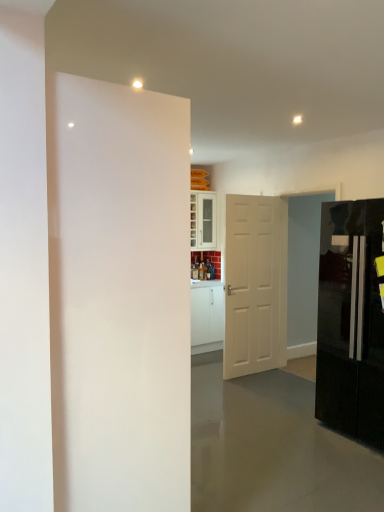
Describe the element at coordinates (255, 284) in the screenshot. This screenshot has width=384, height=512. I see `white matte door at center, acting as the first door starting from the right` at that location.

This screenshot has height=512, width=384. What do you see at coordinates (118, 295) in the screenshot? I see `white glossy door at left, marked as the 2th door in a right-to-left arrangement` at bounding box center [118, 295].

Describe the element at coordinates (203, 220) in the screenshot. I see `white glossy cabinet at center` at that location.

Describe the element at coordinates (351, 321) in the screenshot. The width and height of the screenshot is (384, 512). I see `glossy black refrigerator at right` at that location.

What are the coordinates of `white matte door at center, acting as the first door starting from the right` in the screenshot? It's located at (255, 284).

Is white glossy cabinet at center wider than white glossy door at left, the 1th door in the front-to-back sequence?

No.

Considering the relative sizes of white glossy cabinet at center and white glossy door at left, marked as the first door in a left-to-right arrangement, in the image provided, is white glossy cabinet at center shorter than white glossy door at left, marked as the first door in a left-to-right arrangement,?

Yes.

Is point (192, 206) less distant than point (114, 429)?

That is False.

In the image, is white glossy cabinet at center positioned in front of or behind white glossy door at left, marked as the first door in a left-to-right arrangement?

white glossy cabinet at center is positioned farther from the viewer than white glossy door at left, marked as the first door in a left-to-right arrangement.

Is white glossy door at left, marked as the 2th door in a right-to-left arrangement, inside or outside of glossy black refrigerator at right?

white glossy door at left, marked as the 2th door in a right-to-left arrangement, lies outside glossy black refrigerator at right.

From the image's perspective, is white glossy door at left, marked as the 2th door in a right-to-left arrangement, on top of glossy black refrigerator at right?

Yes, from the image's perspective, white glossy door at left, marked as the 2th door in a right-to-left arrangement, is on top of glossy black refrigerator at right.

Is white glossy door at left, acting as the 2th door starting from the back, facing towards glossy black refrigerator at right?

Yes, white glossy door at left, acting as the 2th door starting from the back, is oriented towards glossy black refrigerator at right.

Considering the relative positions of white glossy door at left, acting as the 2th door starting from the back, and glossy black refrigerator at right in the image provided, is white glossy door at left, acting as the 2th door starting from the back, in front of glossy black refrigerator at right?

Yes, it is.

Considering the sizes of white glossy cabinet at center and glossy black refrigerator at right in the image, is white glossy cabinet at center bigger or smaller than glossy black refrigerator at right?

Clearly, white glossy cabinet at center is smaller in size than glossy black refrigerator at right.

Considering the relative sizes of white glossy cabinet at center and glossy black refrigerator at right in the image provided, is white glossy cabinet at center wider than glossy black refrigerator at right?

No, white glossy cabinet at center is not wider than glossy black refrigerator at right.

The height and width of the screenshot is (512, 384). Identify the location of refrigerator below the white glossy cabinet at center (from a real-world perspective). (351, 321).

Are white glossy cabinet at center and glossy black refrigerator at right making contact?

They are not placed beside each other.

From the image's perspective, between white matte door at center, acting as the first door starting from the right, and white glossy door at left, acting as the 2th door starting from the back, who is located below?

From the image's view, white glossy door at left, acting as the 2th door starting from the back, is below.

Consider the image. Considering the sizes of objects white matte door at center, which is counted as the 2th door, starting from the left, and white glossy door at left, marked as the 2th door in a right-to-left arrangement, in the image provided, who is thinner, white matte door at center, which is counted as the 2th door, starting from the left, or white glossy door at left, marked as the 2th door in a right-to-left arrangement,?

Thinner between the two is white matte door at center, which is counted as the 2th door, starting from the left.

Locate an element on the screen. Image resolution: width=384 pixels, height=512 pixels. door above the white matte door at center, acting as the first door starting from the right (from a real-world perspective) is located at coordinates (118, 295).

Is white matte door at center, which is counted as the 2th door, starting from the left, looking in the opposite direction of white glossy door at left, acting as the 2th door starting from the back?

No, white matte door at center, which is counted as the 2th door, starting from the left, is not facing the opposite direction of white glossy door at left, acting as the 2th door starting from the back.

Consider the image. Who is taller, white matte door at center, which ranks as the 1th door in back-to-front order, or glossy black refrigerator at right?

white matte door at center, which ranks as the 1th door in back-to-front order.

Does white matte door at center, which is counted as the 2th door, starting from the left, touch glossy black refrigerator at right?

They are not placed beside each other.

Is white matte door at center, the second door viewed from the front, completely or partially outside of glossy black refrigerator at right?

Yes, white matte door at center, the second door viewed from the front, is not within glossy black refrigerator at right.

From a real-world perspective, between white matte door at center, which ranks as the 1th door in back-to-front order, and glossy black refrigerator at right, who is vertically higher?

From a 3D spatial view, white matte door at center, which ranks as the 1th door in back-to-front order, is above.

Is glossy black refrigerator at right taller than white glossy cabinet at center?

Indeed, glossy black refrigerator at right has a greater height compared to white glossy cabinet at center.

Can you confirm if glossy black refrigerator at right is bigger than white glossy cabinet at center?

Correct, glossy black refrigerator at right is larger in size than white glossy cabinet at center.

In the scene shown: Is glossy black refrigerator at right at the right side of white glossy cabinet at center?

Correct, you'll find glossy black refrigerator at right to the right of white glossy cabinet at center.

Does glossy black refrigerator at right turn towards white glossy cabinet at center?

No, glossy black refrigerator at right is not turned towards white glossy cabinet at center.

Is glossy black refrigerator at right oriented towards white matte door at center, the second door viewed from the front?

No, glossy black refrigerator at right is not oriented towards white matte door at center, the second door viewed from the front.

Considering the positions of objects glossy black refrigerator at right and white matte door at center, which is counted as the 2th door, starting from the left, in the image provided, who is more to the left, glossy black refrigerator at right or white matte door at center, which is counted as the 2th door, starting from the left,?

From the viewer's perspective, white matte door at center, which is counted as the 2th door, starting from the left, appears more on the left side.

Consider the image. From the image's perspective, which one is positioned lower, glossy black refrigerator at right or white matte door at center, the second door viewed from the front?

glossy black refrigerator at right, from the image's perspective.

Is glossy black refrigerator at right outside of white matte door at center, which is counted as the 2th door, starting from the left?

Indeed, glossy black refrigerator at right is completely outside white matte door at center, which is counted as the 2th door, starting from the left.

Find the location of a particular element. This screenshot has height=512, width=384. the 1st door directly beneath the white glossy cabinet at center (from a real-world perspective) is located at coordinates (118, 295).

The height and width of the screenshot is (512, 384). In order to click on refrigerator below the white glossy door at left, the 1th door in the front-to-back sequence (from the image's perspective) in this screenshot , I will do `click(351, 321)`.

Which object lies nearer to the anchor point white matte door at center, the second door viewed from the front, white glossy door at left, acting as the 2th door starting from the back, or glossy black refrigerator at right?

glossy black refrigerator at right lies closer to white matte door at center, the second door viewed from the front, than the other object.

Considering their positions, is white glossy door at left, acting as the 2th door starting from the back, positioned further to white glossy cabinet at center than white matte door at center, which ranks as the 1th door in back-to-front order?

white glossy door at left, acting as the 2th door starting from the back, is positioned further to the anchor white glossy cabinet at center.

Estimate the real-world distances between objects in this image. Which object is closer to white matte door at center, which ranks as the 1th door in back-to-front order, glossy black refrigerator at right or white glossy door at left, the 1th door in the front-to-back sequence?

Among the two, glossy black refrigerator at right is located nearer to white matte door at center, which ranks as the 1th door in back-to-front order.

Based on their spatial positions, is glossy black refrigerator at right or white glossy door at left, the 1th door in the front-to-back sequence, closer to white glossy cabinet at center?

glossy black refrigerator at right lies closer to white glossy cabinet at center than the other object.

Based on their spatial positions, is white glossy cabinet at center or white glossy door at left, the 1th door in the front-to-back sequence, closer to glossy black refrigerator at right?

white glossy door at left, the 1th door in the front-to-back sequence.

Consider the image. Looking at the image, which one is located further to white glossy door at left, acting as the 2th door starting from the back, glossy black refrigerator at right or white matte door at center, which is counted as the 2th door, starting from the left?

white matte door at center, which is counted as the 2th door, starting from the left, is further to white glossy door at left, acting as the 2th door starting from the back.

Looking at the image, which one is located closer to white glossy door at left, the 1th door in the front-to-back sequence, white matte door at center, acting as the first door starting from the right, or glossy black refrigerator at right?

The object closer to white glossy door at left, the 1th door in the front-to-back sequence, is glossy black refrigerator at right.

Estimate the real-world distances between objects in this image. Which object is closer to glossy black refrigerator at right, white glossy door at left, the 1th door in the front-to-back sequence, or white glossy cabinet at center?

white glossy door at left, the 1th door in the front-to-back sequence, is closer to glossy black refrigerator at right.

Identify the location of refrigerator between white glossy door at left, the 1th door in the front-to-back sequence, and white matte door at center, the second door viewed from the front, in the front-back direction. The image size is (384, 512). pyautogui.click(x=351, y=321).

Image resolution: width=384 pixels, height=512 pixels. Find the location of `door between glossy black refrigerator at right and white glossy cabinet at center in the front-back direction`. door between glossy black refrigerator at right and white glossy cabinet at center in the front-back direction is located at coordinates pos(255,284).

Where is `refrigerator between white glossy door at left, marked as the first door in a left-to-right arrangement, and white glossy cabinet at center, along the z-axis`? refrigerator between white glossy door at left, marked as the first door in a left-to-right arrangement, and white glossy cabinet at center, along the z-axis is located at coordinates (351, 321).

I want to click on door between white glossy door at left, acting as the 2th door starting from the back, and white glossy cabinet at center in the front-back direction, so click(x=255, y=284).